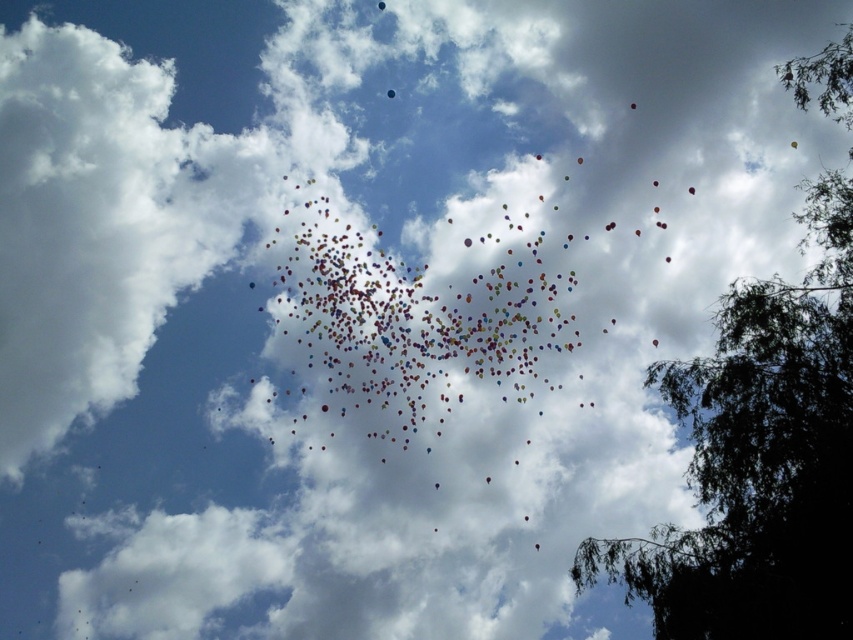
Can you confirm if green leafy tree at upper right is shorter than translucent glossy balloon at upper center?

Incorrect, green leafy tree at upper right's height does not fall short of translucent glossy balloon at upper center's.

This screenshot has width=853, height=640. I want to click on green leafy tree at upper right, so click(759, 460).

Locate an element on the screen. Image resolution: width=853 pixels, height=640 pixels. green leafy tree at upper right is located at coordinates (759, 460).